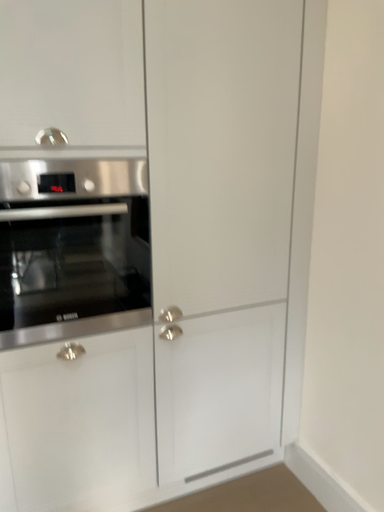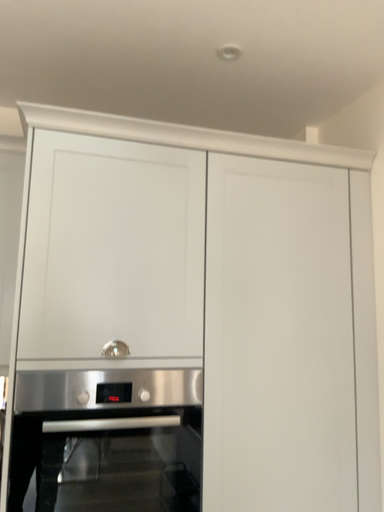
Question: Which way did the camera rotate in the video?

Choices:
 (A) rotated left
 (B) rotated right

Answer: (A)